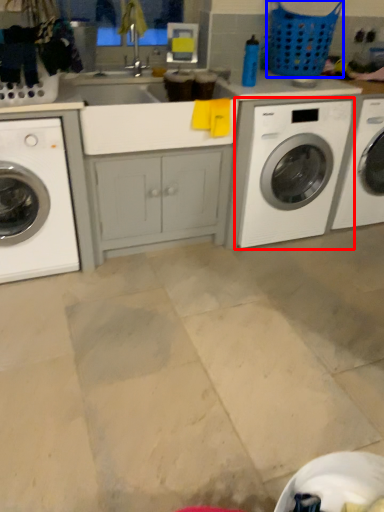
Question: Which object is further to the camera taking this photo, washing machine (highlighted by a red box) or basket (highlighted by a blue box)?

Choices:
 (A) washing machine
 (B) basket

Answer: (B)